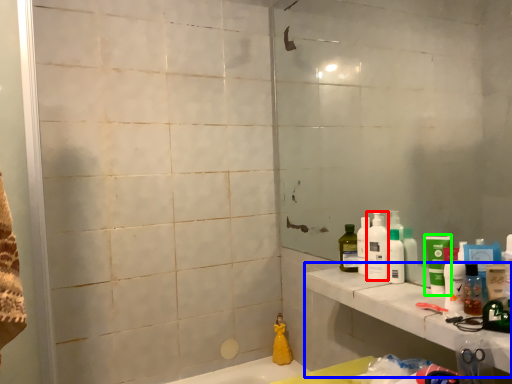
Question: Considering the real-world distances, which object is closest to cleaning product (highlighted by a red box)? counter top (highlighted by a blue box) or mouthwash (highlighted by a green box).

Choices:
 (A) counter top
 (B) mouthwash

Answer: (B)